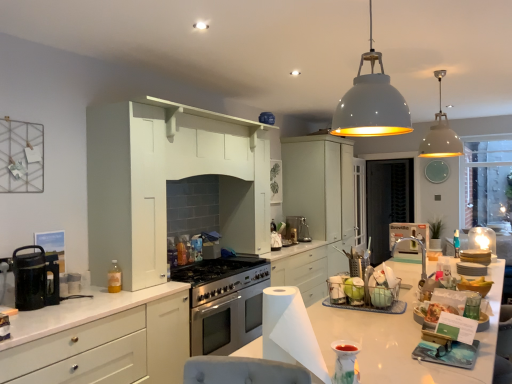
Question: Is white matte cabinet at left, the 2th cabinetry in the right-to-left sequence, oriented towards white paper at center?

Choices:
 (A) no
 (B) yes

Answer: (B)

Question: Is white matte cabinet at left, acting as the 1th cabinetry starting from the front, at the right side of white paper at center?

Choices:
 (A) yes
 (B) no

Answer: (B)

Question: Considering the relative sizes of white matte cabinet at left, acting as the 2th cabinetry starting from the back, and white paper at center in the image provided, is white matte cabinet at left, acting as the 2th cabinetry starting from the back, wider than white paper at center?

Choices:
 (A) no
 (B) yes

Answer: (B)

Question: From a real-world perspective, is white matte cabinet at left, the 2th cabinetry in the right-to-left sequence, below white paper at center?

Choices:
 (A) no
 (B) yes

Answer: (B)

Question: Considering the relative positions of white matte cabinet at left, which appears as the 1th cabinetry when viewed from the left, and white paper at center in the image provided, is white matte cabinet at left, which appears as the 1th cabinetry when viewed from the left, behind white paper at center?

Choices:
 (A) no
 (B) yes

Answer: (B)

Question: Looking at the image, does porcelain vase at lower center, arranged as the sixth appliance when viewed from the right, seem bigger or smaller compared to translucent plastic bottle at left?

Choices:
 (A) small
 (B) big

Answer: (B)

Question: Considering the positions of point (337, 382) and point (112, 289), is point (337, 382) closer or farther from the camera than point (112, 289)?

Choices:
 (A) farther
 (B) closer

Answer: (B)

Question: From a real-world perspective, relative to translucent plastic bottle at left, is porcelain vase at lower center, the first appliance viewed from the front, vertically above or below?

Choices:
 (A) below
 (B) above

Answer: (A)

Question: Would you say porcelain vase at lower center, marked as the 6th appliance in a back-to-front arrangement, is inside or outside translucent plastic bottle at left?

Choices:
 (A) inside
 (B) outside

Answer: (B)

Question: From their relative heights in the image, would you say clear glass cabinet at center is taller or shorter than black glass coffee maker at left?

Choices:
 (A) tall
 (B) short

Answer: (A)

Question: Is clear glass cabinet at center bigger or smaller than black glass coffee maker at left?

Choices:
 (A) small
 (B) big

Answer: (B)

Question: Relative to black glass coffee maker at left, is clear glass cabinet at center in front or behind?

Choices:
 (A) behind
 (B) front

Answer: (A)

Question: Looking at their shapes, would you say clear glass cabinet at center is wider or thinner than black glass coffee maker at left?

Choices:
 (A) wide
 (B) thin

Answer: (B)

Question: Is point click(x=20, y=289) positioned closer to the camera than point click(x=308, y=226)?

Choices:
 (A) farther
 (B) closer

Answer: (B)

Question: From the image's perspective, is black glass coffee maker at left positioned above or below satin silver kettle at center, marked as the 6th appliance in a front-to-back arrangement?

Choices:
 (A) below
 (B) above

Answer: (A)